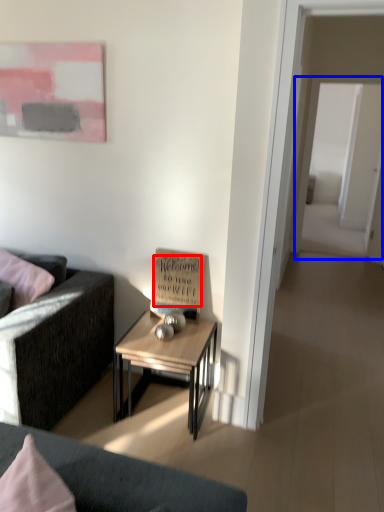
Question: Among these objects, which one is nearest to the camera, writing (highlighted by a red box) or glass door (highlighted by a blue box)?

Choices:
 (A) writing
 (B) glass door

Answer: (A)